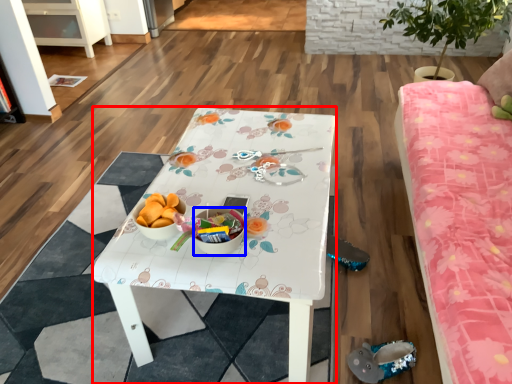
Question: Which object is further to the camera taking this photo, desk (highlighted by a red box) or glass bowl (highlighted by a blue box)?

Choices:
 (A) desk
 (B) glass bowl

Answer: (B)